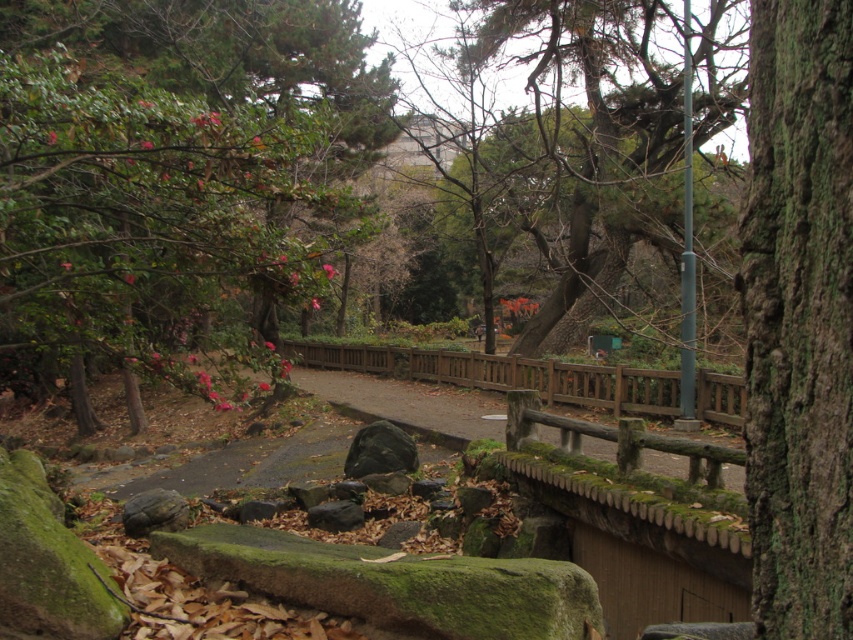
Question: Based on their relative distances, which object is nearer to the green leafy tree at upper left?

Choices:
 (A) dark gray stone at center
 (B) green mossy bark at right
 (C) green textured tree at upper center

Answer: (C)

Question: Can you confirm if green textured tree at upper center is bigger than dark gray stone at center?

Choices:
 (A) no
 (B) yes

Answer: (B)

Question: Does green leafy tree at upper left appear on the left side of green mossy bark at right?

Choices:
 (A) no
 (B) yes

Answer: (B)

Question: Can you confirm if green leafy tree at upper left is thinner than dark gray stone at center?

Choices:
 (A) yes
 (B) no

Answer: (B)

Question: Considering the real-world distances, which object is farthest from the dark gray stone at center?

Choices:
 (A) green textured tree at upper center
 (B) green mossy bark at right

Answer: (A)

Question: Estimate the real-world distances between objects in this image. Which object is farther from the green textured tree at upper center?

Choices:
 (A) green leafy tree at upper left
 (B) green mossy bark at right
 (C) dark gray stone at center

Answer: (B)